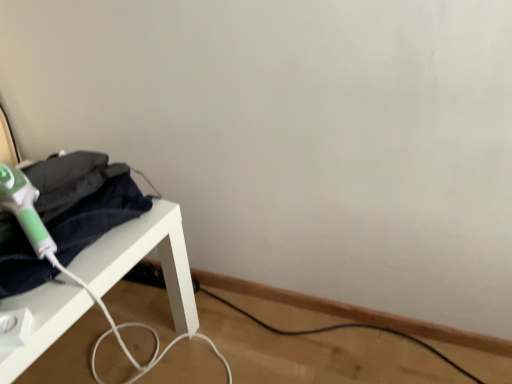
What are the coordinates of `green plastic hair dryer at left` in the screenshot? It's located at (25, 210).

What is the approximate width of green plastic hair dryer at left?

green plastic hair dryer at left is 3.85 inches in width.

What do you see at coordinates (25, 210) in the screenshot?
I see `green plastic hair dryer at left` at bounding box center [25, 210].

What is the approximate width of white plastic table at left?

white plastic table at left is 19.64 inches wide.

What do you see at coordinates (142, 258) in the screenshot?
I see `white plastic table at left` at bounding box center [142, 258].

This screenshot has height=384, width=512. What are the coordinates of `white plastic table at left` in the screenshot? It's located at (142, 258).

At what (x,y) coordinates should I click in order to perform the action: click on green plastic hair dryer at left. Please return your answer as a coordinate pair (x, y). Looking at the image, I should click on (25, 210).

From the picture: Is green plastic hair dryer at left at the left side of white plastic table at left?

In fact, green plastic hair dryer at left is to the right of white plastic table at left.

Is green plastic hair dryer at left in front of or behind white plastic table at left in the image?

Clearly, green plastic hair dryer at left is behind white plastic table at left.

Considering the positions of points (3, 193) and (2, 302), is point (3, 193) closer to camera compared to point (2, 302)?

No, (3, 193) is further to viewer.

From the image's perspective, does green plastic hair dryer at left appear higher than white plastic table at left?

Yes, from the image's perspective, green plastic hair dryer at left is on top of white plastic table at left.

From a real-world perspective, does green plastic hair dryer at left sit lower than white plastic table at left?

Actually, green plastic hair dryer at left is physically above white plastic table at left in the real world.

Does green plastic hair dryer at left have a greater width compared to white plastic table at left?

No, green plastic hair dryer at left is not wider than white plastic table at left.

Considering the sizes of green plastic hair dryer at left and white plastic table at left in the image, is green plastic hair dryer at left taller or shorter than white plastic table at left?

green plastic hair dryer at left is shorter than white plastic table at left.

Is green plastic hair dryer at left smaller than white plastic table at left?

Yes, green plastic hair dryer at left is smaller than white plastic table at left.

Is green plastic hair dryer at left spatially inside white plastic table at left, or outside of it?

green plastic hair dryer at left lies outside white plastic table at left.

Is green plastic hair dryer at left next to white plastic table at left and touching it?

No, green plastic hair dryer at left is not next to white plastic table at left.

Is green plastic hair dryer at left looking in the opposite direction of white plastic table at left?

No.

What's the angular difference between green plastic hair dryer at left and white plastic table at left's facing directions?

The angle between the facing direction of green plastic hair dryer at left and the facing direction of white plastic table at left is 26.5 degrees.

Locate an element on the screen. Image resolution: width=512 pixels, height=384 pixels. hair drier on the right of white plastic table at left is located at coordinates (25, 210).

Considering the relative positions of white plastic table at left and green plastic hair dryer at left in the image provided, is white plastic table at left to the right of green plastic hair dryer at left from the viewer's perspective?

Incorrect, white plastic table at left is not on the right side of green plastic hair dryer at left.

Is white plastic table at left in front of or behind green plastic hair dryer at left in the image?

white plastic table at left is in front of green plastic hair dryer at left.

Between point (39, 344) and point (45, 244), which one is positioned behind?

Point (45, 244)

From the image's perspective, relative to green plastic hair dryer at left, is white plastic table at left above or below?

Clearly, from the image's perspective, white plastic table at left is below green plastic hair dryer at left.

From a real-world perspective, which is physically below, white plastic table at left or green plastic hair dryer at left?

white plastic table at left, from a real-world perspective.

Is white plastic table at left wider or thinner than green plastic hair dryer at left?

In the image, white plastic table at left appears to be wider than green plastic hair dryer at left.

Is white plastic table at left taller or shorter than green plastic hair dryer at left?

In the image, white plastic table at left appears to be taller than green plastic hair dryer at left.

Which of these two, white plastic table at left or green plastic hair dryer at left, is bigger?

Bigger between the two is white plastic table at left.

From the picture: Would you say green plastic hair dryer at left is part of white plastic table at left's contents?

No, white plastic table at left does not contain green plastic hair dryer at left.

Are white plastic table at left and green plastic hair dryer at left beside each other?

white plastic table at left and green plastic hair dryer at left are clearly separated.

From the picture: Is white plastic table at left looking in the opposite direction of green plastic hair dryer at left?

No, green plastic hair dryer at left is not at the back of white plastic table at left.

How different are the orientations of white plastic table at left and green plastic hair dryer at left in degrees?

The angle between the facing direction of white plastic table at left and the facing direction of green plastic hair dryer at left is 26.5 degrees.

How far apart are white plastic table at left and green plastic hair dryer at left?

They are 8.41 inches apart.

Locate an element on the screen. This screenshot has height=384, width=512. hair drier that is on the right side of white plastic table at left is located at coordinates (25, 210).

Where is `hair drier above the white plastic table at left (from a real-world perspective)`? This screenshot has width=512, height=384. hair drier above the white plastic table at left (from a real-world perspective) is located at coordinates (25, 210).

Where is `furniture below the green plastic hair dryer at left (from the image's perspective)`? The width and height of the screenshot is (512, 384). furniture below the green plastic hair dryer at left (from the image's perspective) is located at coordinates (142, 258).